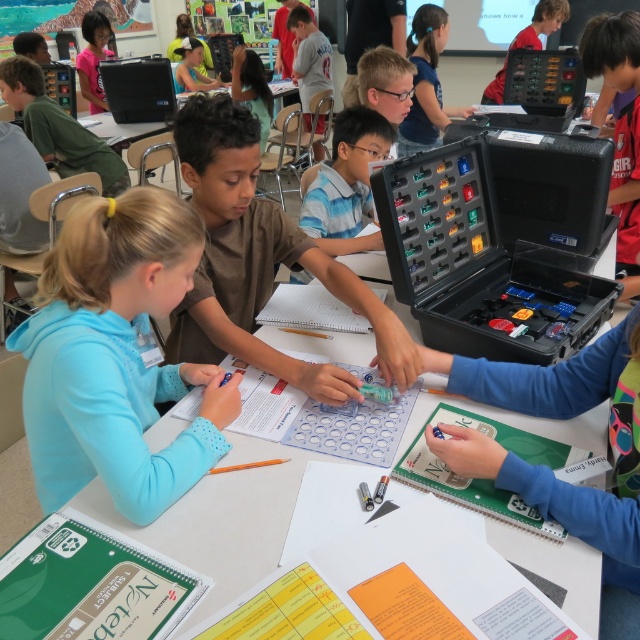
Is matte pink shirt at upper left to the left of yellow-green fabric cap at upper center from the viewer's perspective?

Correct, you'll find matte pink shirt at upper left to the left of yellow-green fabric cap at upper center.

Between point (97, 17) and point (189, 58), which one is positioned behind?

Point (189, 58)

The height and width of the screenshot is (640, 640). What are the coordinates of `matte pink shirt at upper left` in the screenshot? It's located at (93, 58).

Is brown matte shirt at center above matte green shirt at upper center?

No, brown matte shirt at center is not above matte green shirt at upper center.

From the picture: Does brown matte shirt at center have a smaller size compared to matte green shirt at upper center?

No.

Find the location of `brown matte shirt at center`. brown matte shirt at center is located at coordinates (259, 260).

Is light blue fleece at center above black plastic toolbox at center?

No, light blue fleece at center is not above black plastic toolbox at center.

Is light blue fleece at center taller than black plastic toolbox at center?

Yes, light blue fleece at center is taller than black plastic toolbox at center.

Find the location of a particular element. light blue fleece at center is located at coordinates (115, 356).